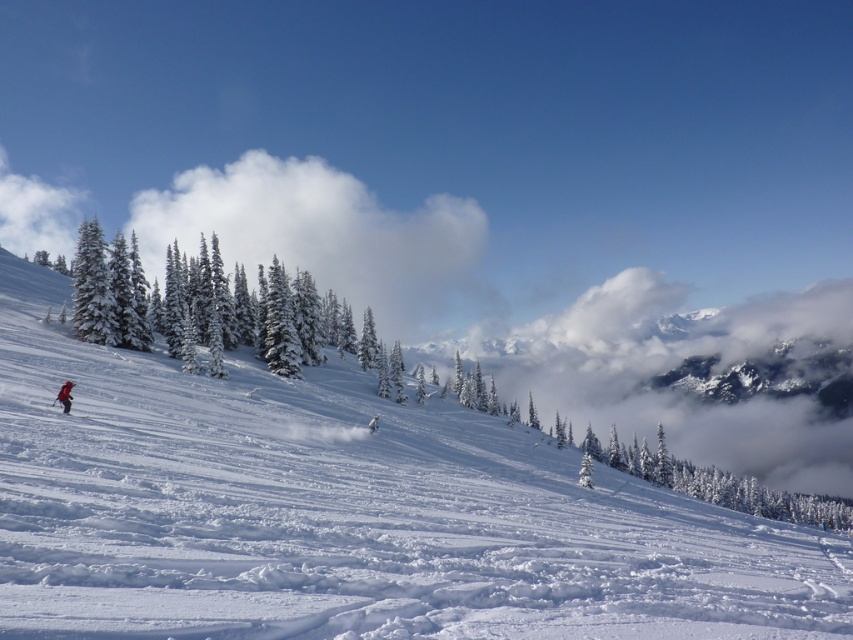
Who is more forward, (360, 289) or (56, 397)?

Positioned in front is point (56, 397).

Is point (437, 220) farther from viewer compared to point (67, 401)?

Yes, it is.

Between point (381, 253) and point (62, 394), which one is positioned behind?

Point (381, 253)

This screenshot has height=640, width=853. I want to click on white fluffy cloud at upper center, so click(323, 234).

In the scene shown: Who is higher up, white powdery snow at lower left or white fluffy cloud at upper center?

white fluffy cloud at upper center is higher up.

Can you confirm if white powdery snow at lower left is wider than white fluffy cloud at upper center?

No.

You are a GUI agent. You are given a task and a screenshot of the screen. Output one action in this format:
    pyautogui.click(x=<x>, y=<y>)
    Task: Click on the white powdery snow at lower left
    The image size is (853, 640).
    Given the screenshot: What is the action you would take?
    pyautogui.click(x=346, y=513)

From the picture: Which of these two, white fluffy cloud at upper center or black matte ski at lower left, stands taller?

Standing taller between the two is white fluffy cloud at upper center.

Can you confirm if white fluffy cloud at upper center is positioned to the left of black matte ski at lower left?

Indeed, white fluffy cloud at upper center is positioned on the left side of black matte ski at lower left.

The image size is (853, 640). Identify the location of white fluffy cloud at upper center. (323, 234).